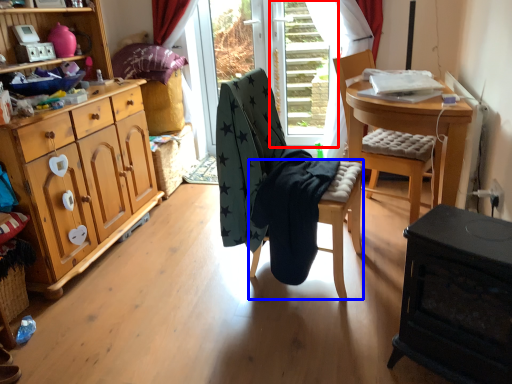
Question: Which point is closer to the camera, screen door (highlighted by a red box) or stool (highlighted by a blue box)?

Choices:
 (A) screen door
 (B) stool

Answer: (B)